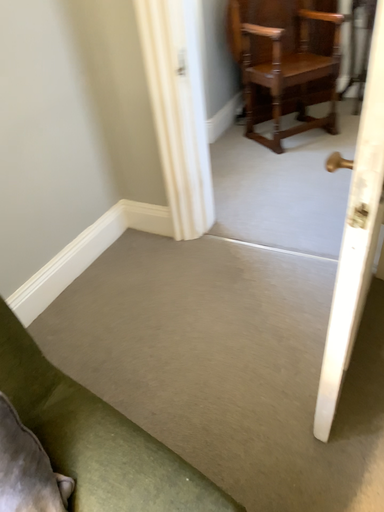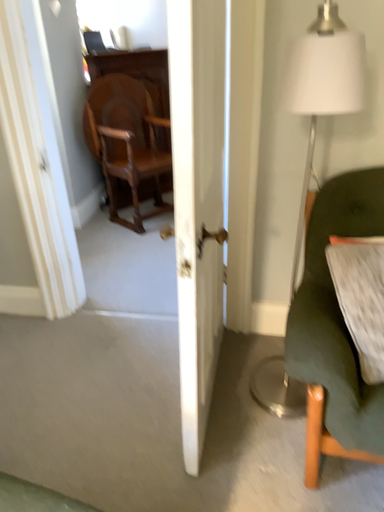
Question: How did the camera likely rotate when shooting the video?

Choices:
 (A) rotated upward
 (B) rotated downward

Answer: (A)